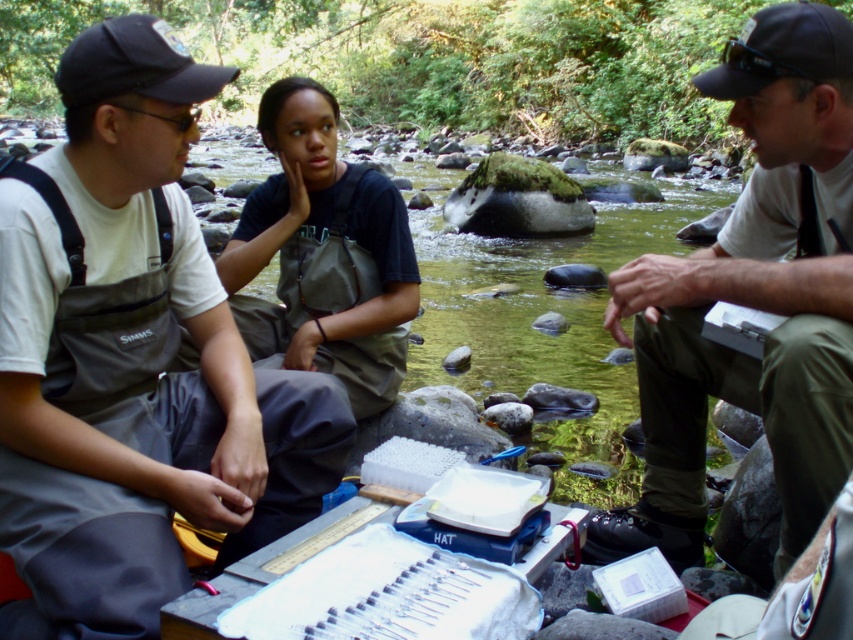
You are a photographer setting up a wide shot of the scene. You want to ensure both the gray fabric waders at left and the matte white shirt at center are fully visible in the frame. Based on their positions, which object requires a wider angle to capture in its entirety?

The gray fabric waders at left might require a wider angle to capture in its entirety since they are wider than the matte white shirt at center.

You are an outdoor photographer wanting to capture the gray fabric waders at left and the black fabric baseball cap at upper left in your shot. Which object would require a closer focus to capture details due to its smaller size?

The gray fabric waders at left is thinner than the black fabric baseball cap at upper left, so you would need to focus closer on the gray fabric waders at left to capture its details because it is smaller in size.

You are a photographer trying to capture a candid shot of the matte white shirt at center and the black fabric baseball cap at upper left without them noticing. Since you want to ensure both subjects are in focus, which one should you focus on first to maintain depth of field?

The matte white shirt at center is positioned under the black fabric baseball cap at upper left, so focusing on the black fabric baseball cap at upper left first will ensure both are in focus due to its closer proximity to the camera.